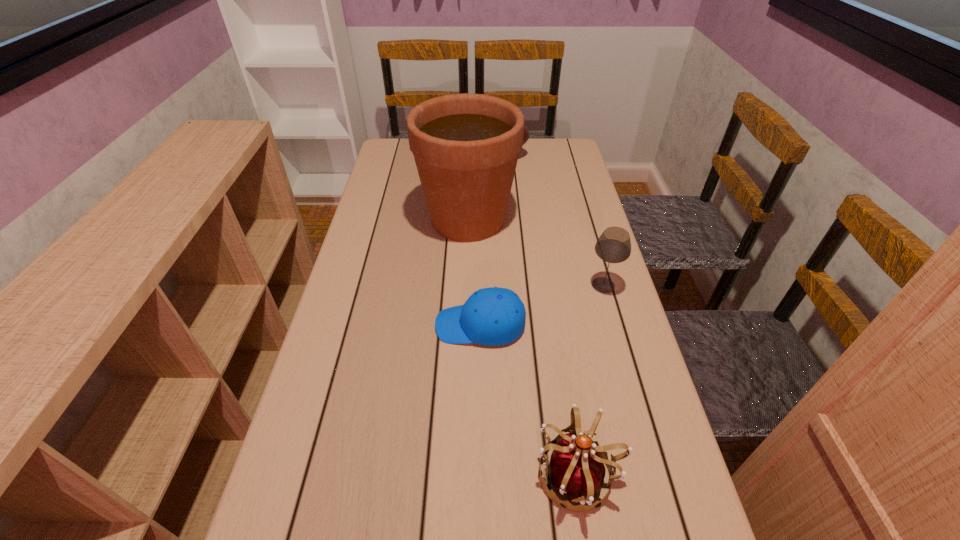
You are a GUI agent. You are given a task and a screenshot of the screen. Output one action in this format:
    pyautogui.click(x=<x>, y=<y>)
    Task: Click on the tallest object
    
    Given the screenshot: What is the action you would take?
    pyautogui.click(x=466, y=146)

Identify the location of flowerpot. (466, 146).

Locate an element on the screen. This screenshot has height=540, width=960. football (American) is located at coordinates (526, 133).

Locate an element on the screen. the rightmost object is located at coordinates (614, 245).

Find the location of a particular element. The image size is (960, 540). wineglass is located at coordinates (614, 245).

I want to click on the nearest object, so click(576, 469).

The height and width of the screenshot is (540, 960). Identify the location of the shortest object. [x=490, y=316].

Identify the location of cap. (490, 316).

The image size is (960, 540). I want to click on free space located on the left of the flowerpot, so click(376, 219).

At what (x,y) coordinates should I click in order to perform the action: click on vacant space located 0.300m on the front of the football (American). Please return your answer as a coordinate pair (x, y). Looking at the image, I should click on (484, 218).